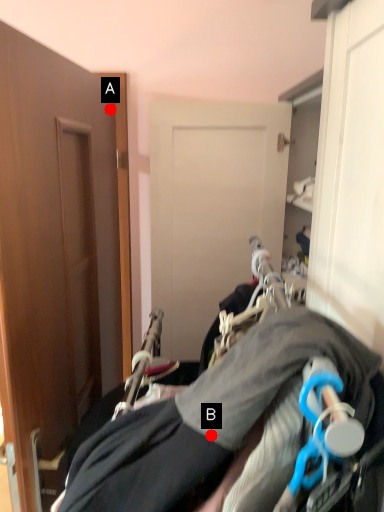
Question: Two points are circled on the image, labeled by A and B beside each circle. Which point is further to the camera?

Choices:
 (A) A is further
 (B) B is further

Answer: (A)